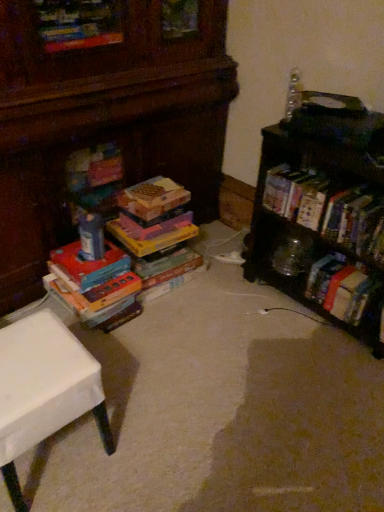
Question: Considering the relative sizes of clear plastic bottle at upper right, marked as the second toy in a bottom-to-top arrangement, and wooden bookshelf at right in the image provided, is clear plastic bottle at upper right, marked as the second toy in a bottom-to-top arrangement, thinner than wooden bookshelf at right?

Choices:
 (A) yes
 (B) no

Answer: (A)

Question: Is clear plastic bottle at upper right, which is the second toy from left to right, further to camera compared to wooden bookshelf at right?

Choices:
 (A) yes
 (B) no

Answer: (A)

Question: Can you see clear plastic bottle at upper right, marked as the second toy in a bottom-to-top arrangement, touching wooden bookshelf at right?

Choices:
 (A) no
 (B) yes

Answer: (A)

Question: Could you tell me if clear plastic bottle at upper right, which is the second toy from left to right, is turned towards wooden bookshelf at right?

Choices:
 (A) no
 (B) yes

Answer: (A)

Question: Does clear plastic bottle at upper right, the 1th toy from the top, come in front of wooden bookshelf at right?

Choices:
 (A) no
 (B) yes

Answer: (A)

Question: Do you think multicolored cardboard books at left, which is the first book in left-to-right order, is within matte plastic toy at center, the second toy in the top-to-bottom sequence, or outside of it?

Choices:
 (A) outside
 (B) inside

Answer: (A)

Question: From a real-world perspective, is multicolored cardboard books at left, which is the first book in left-to-right order, physically located above or below matte plastic toy at center, which is the second toy from right to left?

Choices:
 (A) above
 (B) below

Answer: (B)

Question: Looking at the image, does multicolored cardboard books at left, which is the first book in left-to-right order, seem bigger or smaller compared to matte plastic toy at center, marked as the first toy in a bottom-to-top arrangement?

Choices:
 (A) big
 (B) small

Answer: (A)

Question: In the image, is multicolored cardboard books at left, the 2th book in the right-to-left sequence, positioned in front of or behind matte plastic toy at center, marked as the first toy in a bottom-to-top arrangement?

Choices:
 (A) behind
 (B) front

Answer: (B)

Question: Is matte plastic toy at center, which is the second toy from right to left, spatially inside multicolored cardboard books at left, which is the first book in left-to-right order, or outside of it?

Choices:
 (A) inside
 (B) outside

Answer: (B)

Question: Based on their sizes in the image, would you say matte plastic toy at center, marked as the first toy in a bottom-to-top arrangement, is bigger or smaller than multicolored cardboard books at left, the 2th book in the right-to-left sequence?

Choices:
 (A) small
 (B) big

Answer: (A)

Question: Is matte plastic toy at center, which is the second toy from right to left, taller or shorter than multicolored cardboard books at left, which is the first book in left-to-right order?

Choices:
 (A) short
 (B) tall

Answer: (A)

Question: From a real-world perspective, relative to multicolored cardboard books at left, which is the first book in left-to-right order, is matte plastic toy at center, marked as the first toy in a bottom-to-top arrangement, vertically above or below?

Choices:
 (A) above
 (B) below

Answer: (A)

Question: Considering the positions of point (345, 321) and point (76, 315), is point (345, 321) closer or farther from the camera than point (76, 315)?

Choices:
 (A) farther
 (B) closer

Answer: (A)

Question: Considering the positions of wooden bookshelf at right and multicolored cardboard books at left, the 2th book in the right-to-left sequence, in the image, is wooden bookshelf at right bigger or smaller than multicolored cardboard books at left, the 2th book in the right-to-left sequence,?

Choices:
 (A) big
 (B) small

Answer: (A)